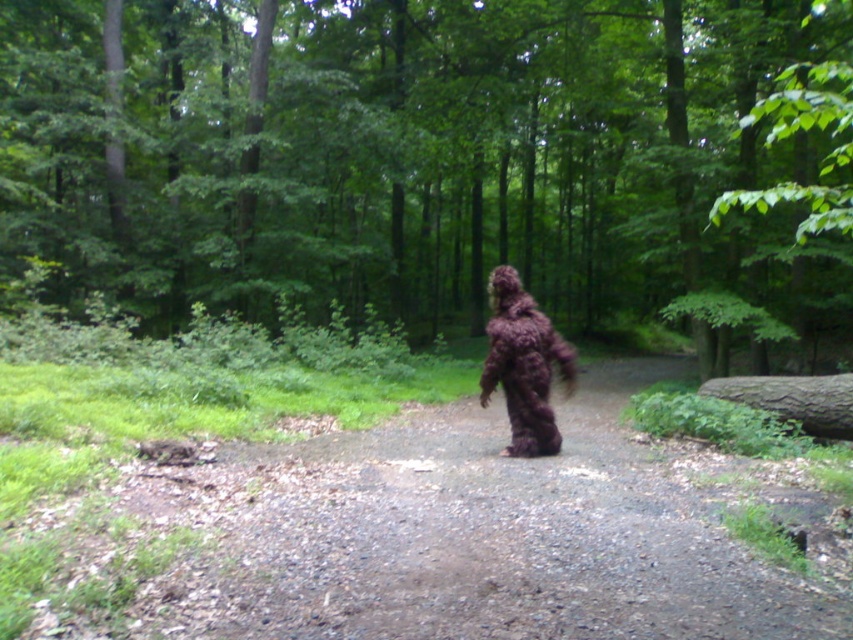
You are a park ranger observing the forest scene. You notice two figures dressed in costumes at the center of the path. The costumes are labeled as the brown furry suit at center and the fuzzy camouflage suit at center. Which costume is taller?

The brown furry suit at center is taller than the fuzzy camouflage suit at center according to the description.

You are a hiker who has spotted two figures in the forest. You see a brown furry suit at center and a fuzzy camouflage suit at center. Which one is more to the left?

The brown furry suit at center is more to the left because it is positioned on the left side of the fuzzy camouflage suit at center.